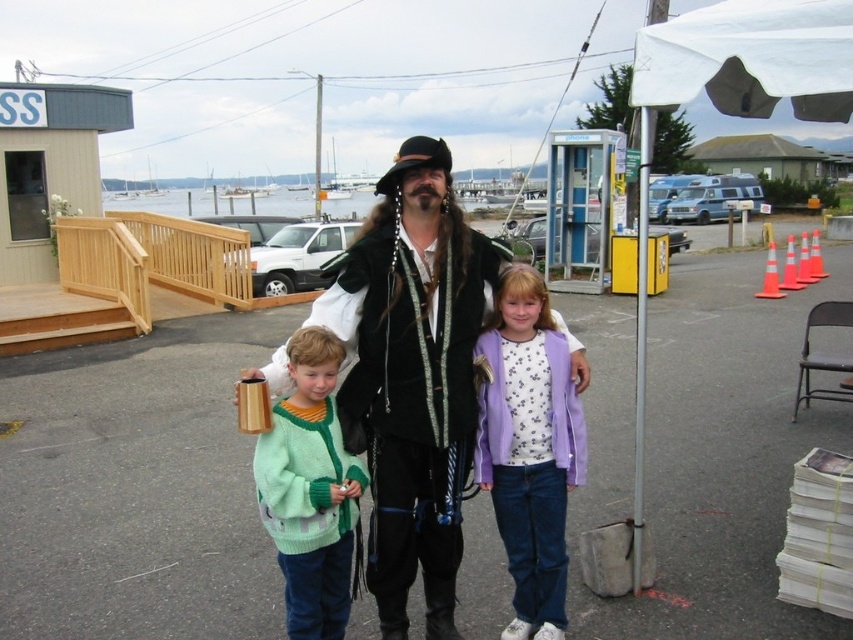
Question: Which point is closer to the camera?

Choices:
 (A) shiny black vest at center
 (B) purple cotton jacket at center
 (C) green knitted sweater at center

Answer: (C)

Question: Which point appears farthest from the camera in this image?

Choices:
 (A) (529, 381)
 (B) (438, 144)

Answer: (A)

Question: Can you confirm if shiny black vest at center is wider than purple cotton jacket at center?

Choices:
 (A) yes
 (B) no

Answer: (A)

Question: Among these points, which one is nearest to the camera?

Choices:
 (A) [x=341, y=600]
 (B) [x=386, y=394]
 (C) [x=531, y=426]

Answer: (B)

Question: Is shiny black vest at center in front of purple cotton jacket at center?

Choices:
 (A) no
 (B) yes

Answer: (B)

Question: Can you confirm if shiny black vest at center is smaller than green knitted sweater at center?

Choices:
 (A) yes
 (B) no

Answer: (B)